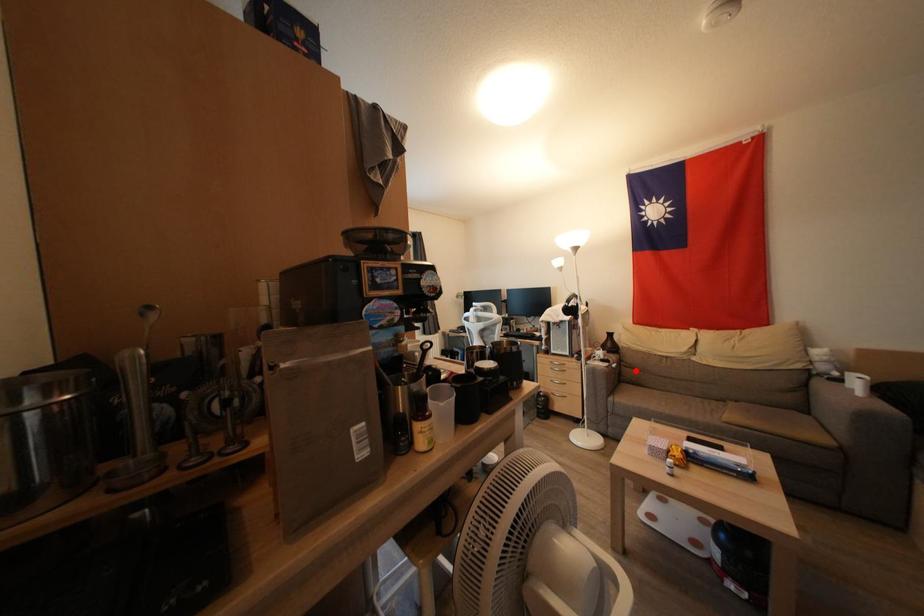
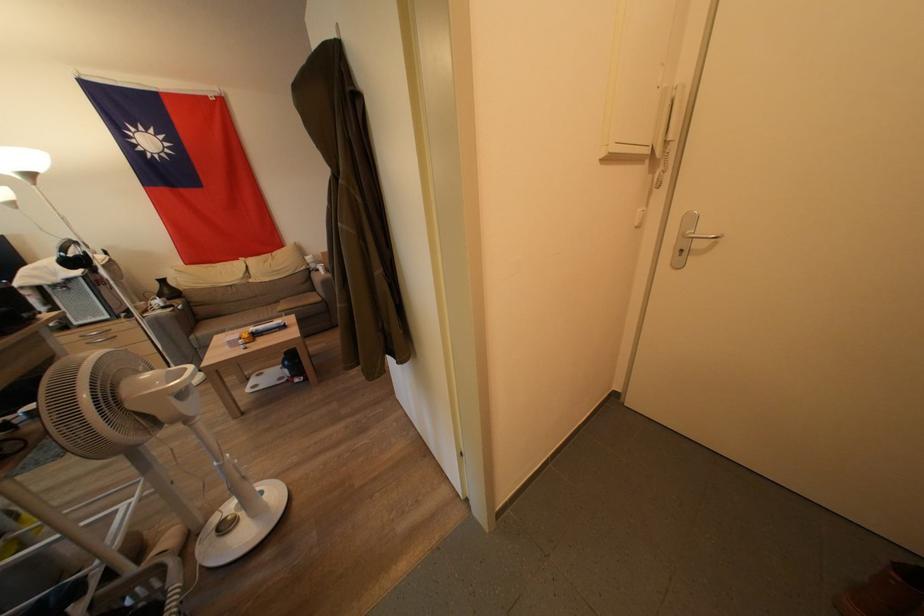
Question: A red point is marked in image1. In image2, is the corresponding 3D point closer to the camera or farther? Reply with the corresponding letter.

Choices:
 (A) The corresponding 3D point is closer.
 (B) The corresponding 3D point is farther.

Answer: (A)